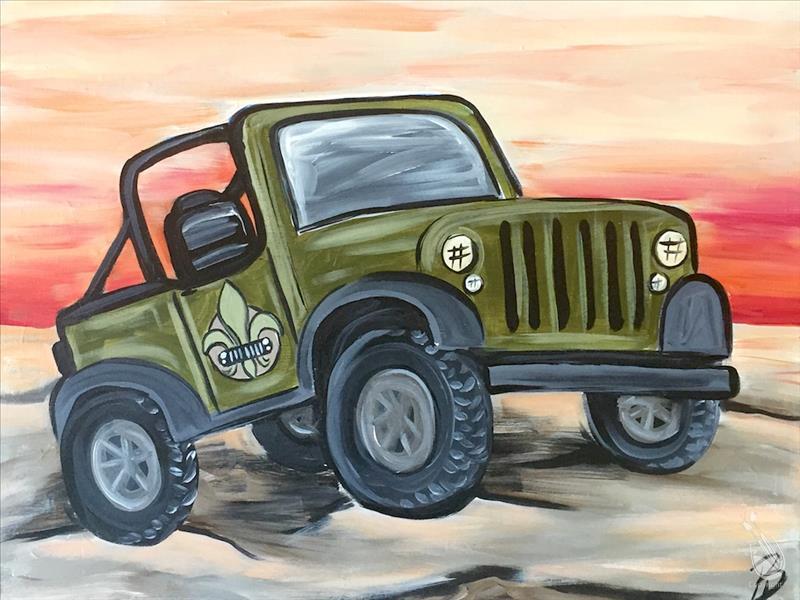
Find the location of a particular element. black seat is located at coordinates (205, 208).